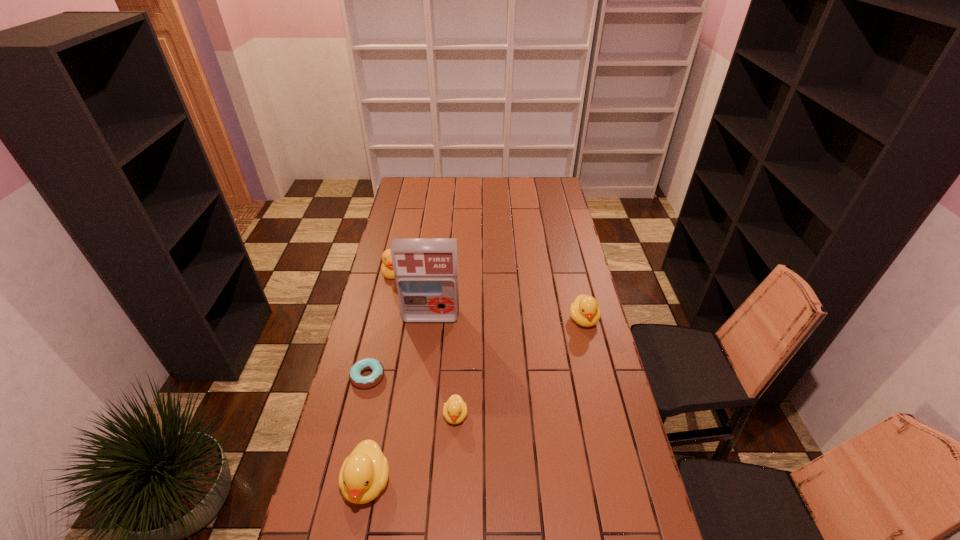
Where is `object that is at the right edge`? This screenshot has height=540, width=960. object that is at the right edge is located at coordinates (584, 310).

Locate an element on the screen. The width and height of the screenshot is (960, 540). object positioned at the near left corner is located at coordinates (364, 473).

At what (x,y) coordinates should I click in order to perform the action: click on free space at the far edge. Please return your answer as a coordinate pair (x, y). Looking at the image, I should click on (509, 193).

In the image, there is a desktop. Where is `free space at the near edge`? free space at the near edge is located at coordinates (563, 511).

The image size is (960, 540). In the image, there is a desktop. In order to click on vacant region at the left edge in this screenshot , I will do `click(412, 211)`.

Identify the location of vacant region at the right edge of the desktop. (555, 278).

Find the location of `vacant space at the far left corner`. vacant space at the far left corner is located at coordinates (423, 194).

Identify the location of vacant space at the far right corner. This screenshot has width=960, height=540. (533, 193).

In order to click on empty space that is in between the duck and the second shortest duckling in this screenshot , I will do `click(489, 296)`.

What are the coordinates of `empty location between the second shortest object and the doughnut` in the screenshot? It's located at (412, 396).